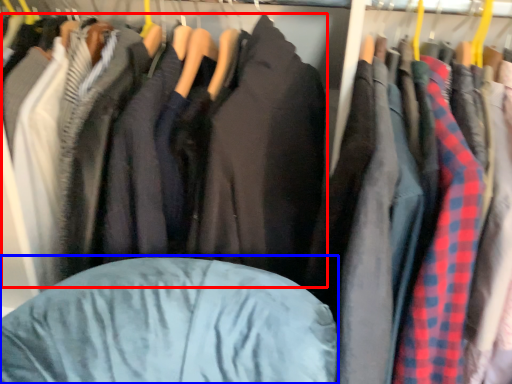
Question: Among these objects, which one is nearest to the camera, jacket (highlighted by a red box) or bean bag chair (highlighted by a blue box)?

Choices:
 (A) jacket
 (B) bean bag chair

Answer: (B)